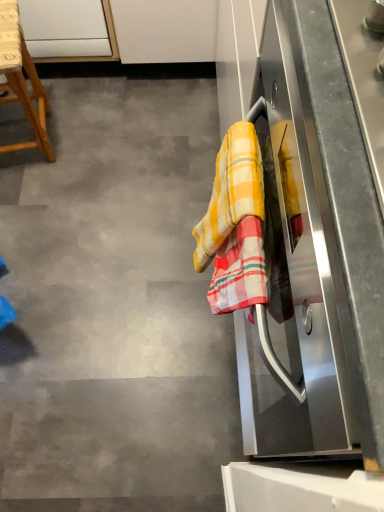
Question: From the image's perspective, is plaid cotton beach towel at right positioned above or below yellow checkered towel at right?

Choices:
 (A) below
 (B) above

Answer: (A)

Question: Is plaid cotton beach towel at right inside the boundaries of yellow checkered towel at right, or outside?

Choices:
 (A) inside
 (B) outside

Answer: (B)

Question: Estimate the real-world distances between objects in this image. Which object is closer to the wooden stool at left?

Choices:
 (A) yellow checkered towel at right
 (B) yellow checkered towel at right
 (C) stainless steel oven at right
 (D) plaid cotton beach towel at right

Answer: (B)

Question: Estimate the real-world distances between objects in this image. Which object is closer to the yellow checkered towel at right?

Choices:
 (A) wooden stool at left
 (B) yellow checkered towel at right
 (C) plaid cotton beach towel at right
 (D) stainless steel oven at right

Answer: (A)